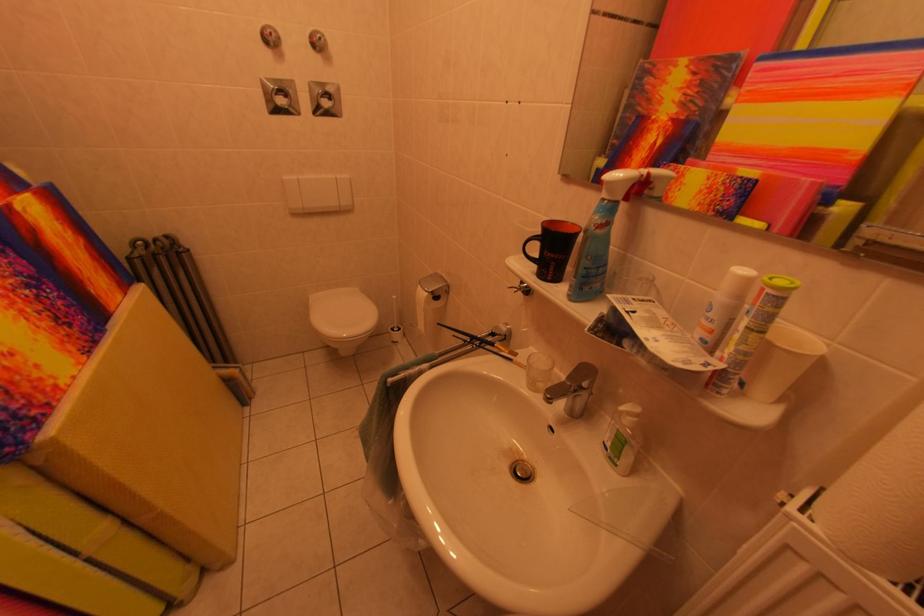
Where would you lift the black mug handle? Please return your answer as a coordinate pair (x, y).

(553, 248)